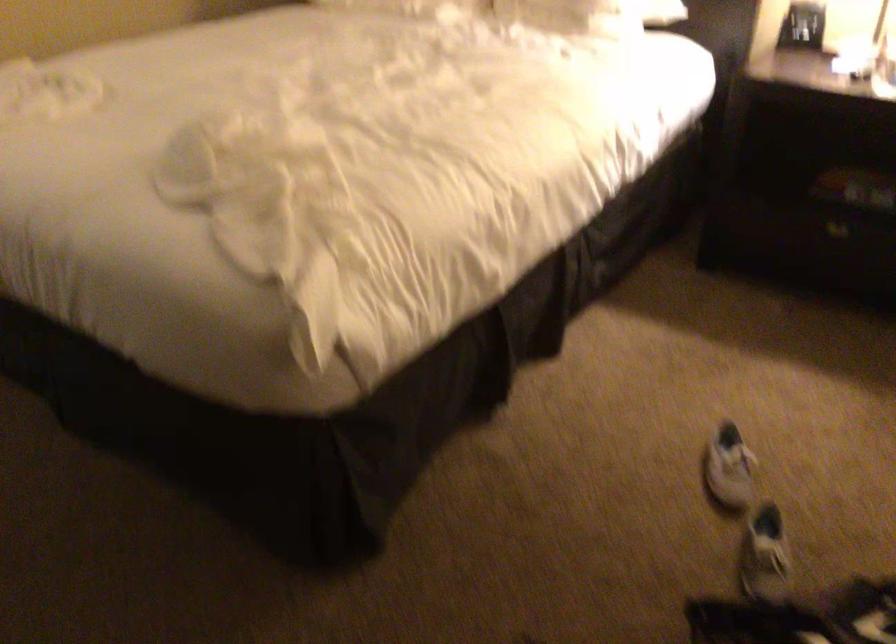
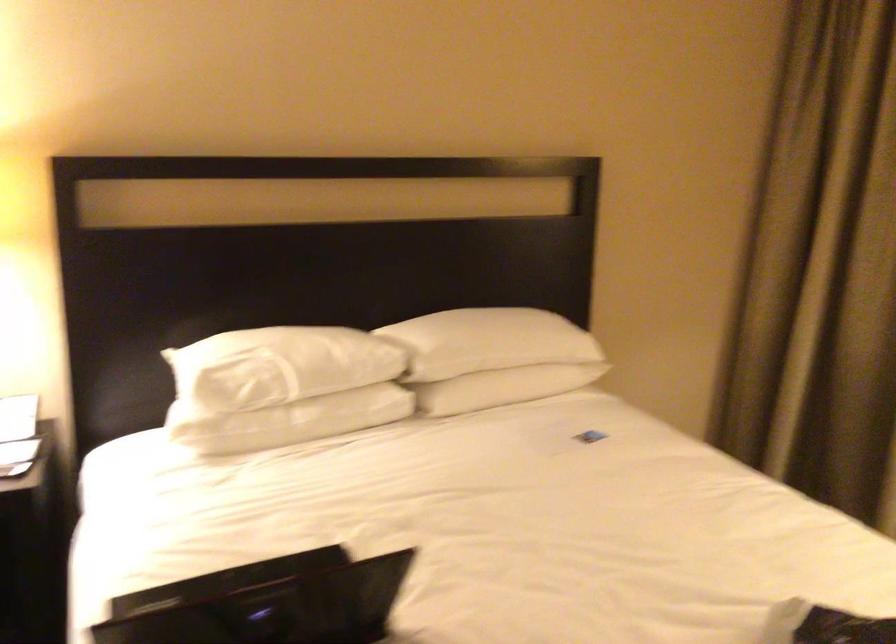
Question: The images are taken continuously from a first-person perspective. In which direction is your viewpoint rotating?

Choices:
 (A) Left
 (B) Right
 (C) Up
 (D) Down

Answer: (B)